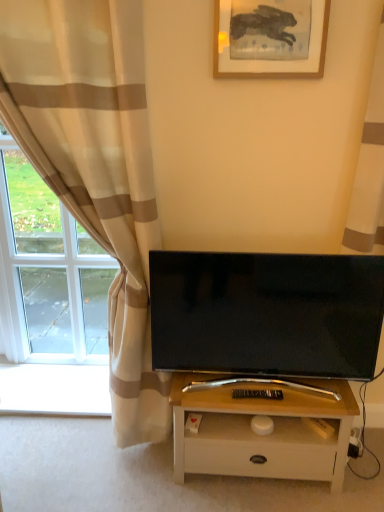
Identify the location of free spot in front of beige striped curtain at left, acting as the 2th curtain starting from the right. (71, 481).